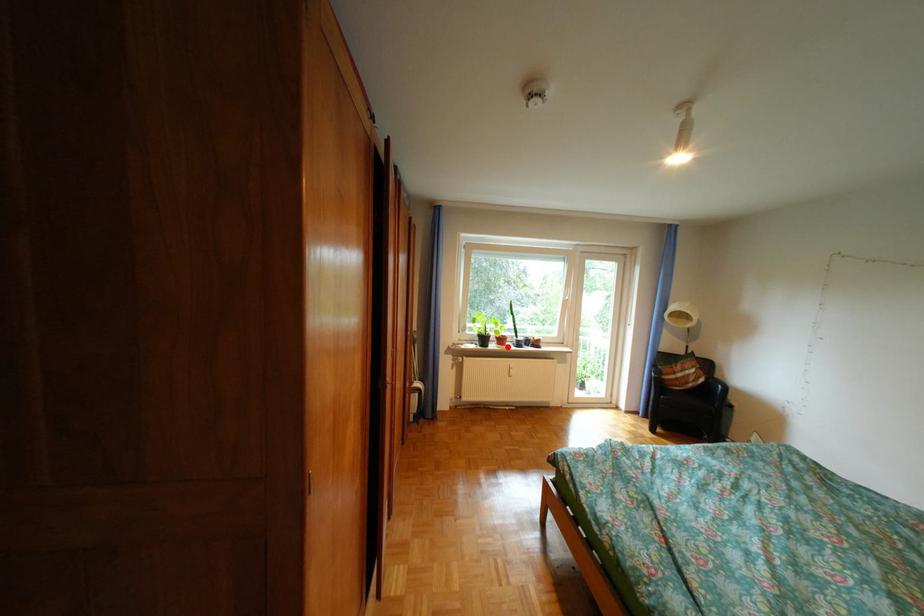
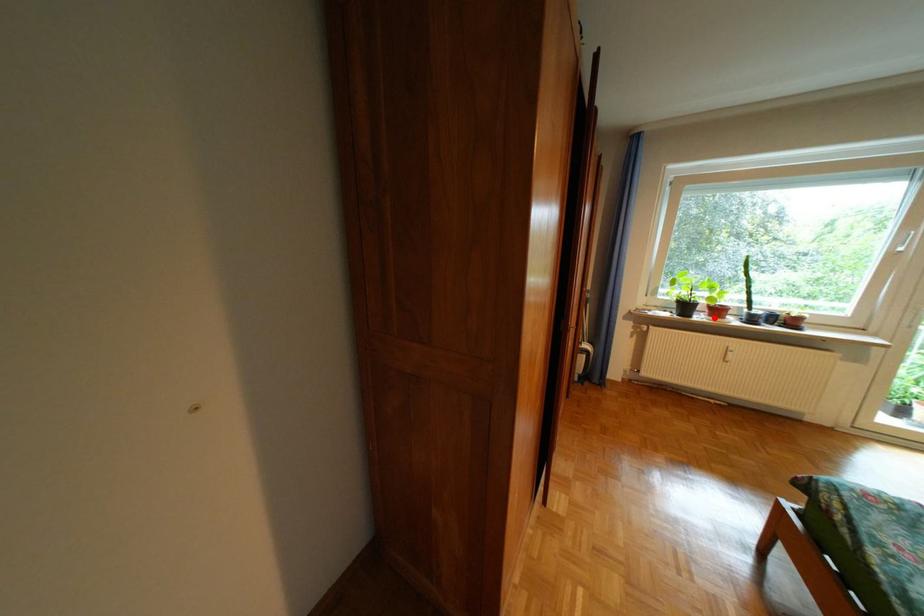
I am providing you with two images of the same scene from different viewpoints. A red point is marked on the first image and another point is marked on the second image. Do the highlighted points in image1 and image2 indicate the same real-world spot?

Yes